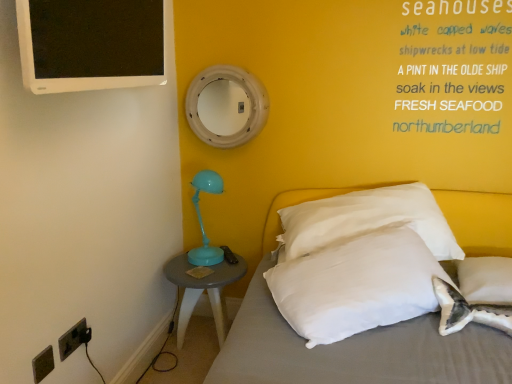
Question: Can you confirm if black plastic electrical outlet at lower left, placed as the 2th electric outlet when sorted from front to back, is smaller than white soft pillow at center, the 2th pillow viewed from the right?

Choices:
 (A) no
 (B) yes

Answer: (B)

Question: Could you tell me if black plastic electrical outlet at lower left, placed as the 2th electric outlet when sorted from front to back, is turned towards white soft pillow at center, the first pillow viewed from the left?

Choices:
 (A) yes
 (B) no

Answer: (A)

Question: Considering the relative sizes of black plastic electrical outlet at lower left, positioned as the 1th electric outlet in back-to-front order, and white soft pillow at center, the first pillow viewed from the left, in the image provided, is black plastic electrical outlet at lower left, positioned as the 1th electric outlet in back-to-front order, bigger than white soft pillow at center, the first pillow viewed from the left,?

Choices:
 (A) no
 (B) yes

Answer: (A)

Question: Does black plastic electrical outlet at lower left, placed as the 2th electric outlet when sorted from front to back, have a lesser width compared to white soft pillow at center, the 2th pillow viewed from the right?

Choices:
 (A) no
 (B) yes

Answer: (B)

Question: Can you confirm if black plastic electrical outlet at lower left, positioned as the 1th electric outlet in back-to-front order, is taller than white soft pillow at center, the first pillow viewed from the left?

Choices:
 (A) no
 (B) yes

Answer: (A)

Question: Is the depth of black plastic electrical outlet at lower left, positioned as the 1th electric outlet in back-to-front order, less than that of white soft pillow at center, the 2th pillow viewed from the right?

Choices:
 (A) yes
 (B) no

Answer: (B)

Question: Considering the relative sizes of matte gray side table at lower left and white painted wood mirror at upper center in the image provided, is matte gray side table at lower left smaller than white painted wood mirror at upper center?

Choices:
 (A) no
 (B) yes

Answer: (A)

Question: Does matte gray side table at lower left come behind white painted wood mirror at upper center?

Choices:
 (A) no
 (B) yes

Answer: (A)

Question: Is matte gray side table at lower left not near white painted wood mirror at upper center?

Choices:
 (A) no
 (B) yes

Answer: (A)

Question: Is matte gray side table at lower left aimed at white painted wood mirror at upper center?

Choices:
 (A) no
 (B) yes

Answer: (A)

Question: Considering the relative sizes of matte gray side table at lower left and white painted wood mirror at upper center in the image provided, is matte gray side table at lower left bigger than white painted wood mirror at upper center?

Choices:
 (A) yes
 (B) no

Answer: (A)

Question: From a real-world perspective, does matte gray side table at lower left sit lower than white painted wood mirror at upper center?

Choices:
 (A) no
 (B) yes

Answer: (B)

Question: Can you confirm if white soft pillow at center, the first pillow viewed from the left, is shorter than matte gray side table at lower left?

Choices:
 (A) no
 (B) yes

Answer: (B)